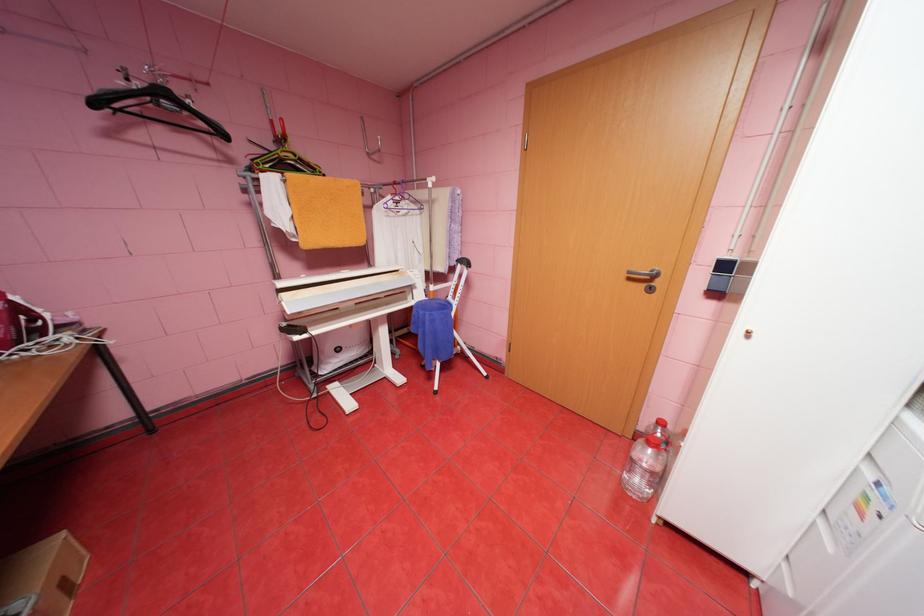
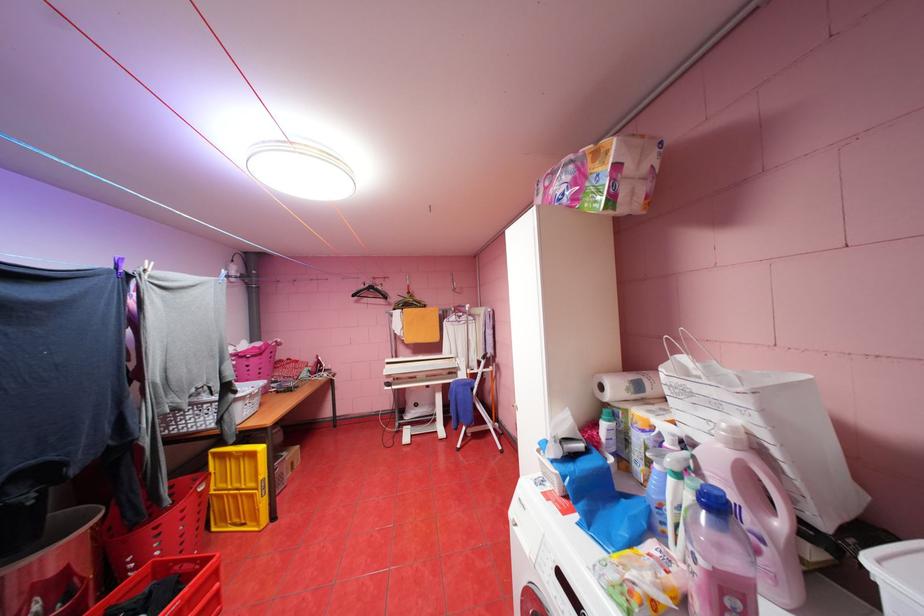
Where in the second image is the point corresponding to the point at 305,338 from the first image?

(395, 387)